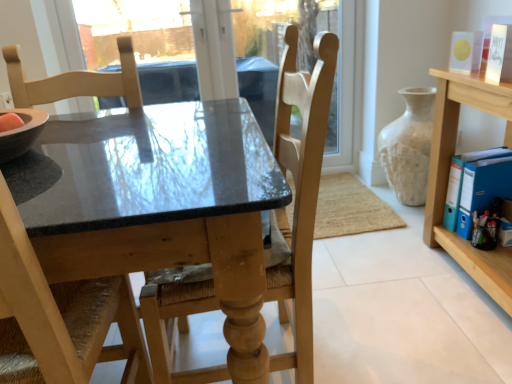
Question: From the image's perspective, is light wood shelf at right above or below matte black table at center?

Choices:
 (A) below
 (B) above

Answer: (B)

Question: Is light wood shelf at right wider or thinner than matte black table at center?

Choices:
 (A) wide
 (B) thin

Answer: (B)

Question: Estimate the real-world distances between objects in this image. Which object is closer to the light wood shelf at right?

Choices:
 (A) matte black table at center
 (B) wooden chair at center, placed as the 2th chair when sorted from left to right
 (C) light wood chair at left, the 2th chair when ordered from right to left
 (D) white textured vase at right

Answer: (D)

Question: Estimate the real-world distances between objects in this image. Which object is farther from the matte black table at center?

Choices:
 (A) wooden chair at center, placed as the 2th chair when sorted from left to right
 (B) light wood shelf at right
 (C) white textured vase at right
 (D) light wood chair at left, which ranks as the first chair in left-to-right order

Answer: (C)